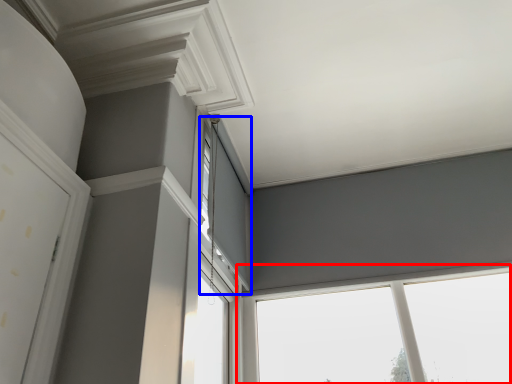
Question: Which object is further to the camera taking this photo, window (highlighted by a red box) or window (highlighted by a blue box)?

Choices:
 (A) window
 (B) window

Answer: (A)